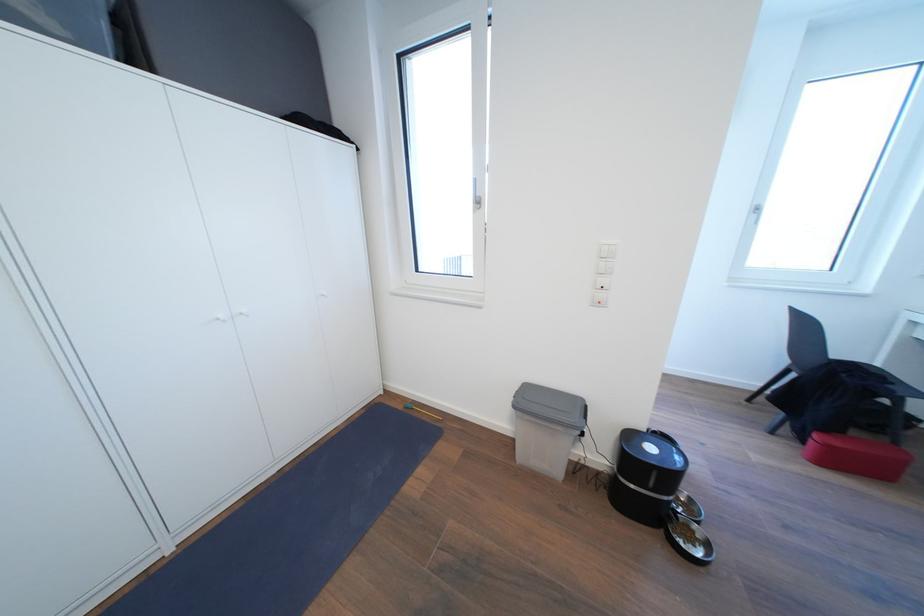
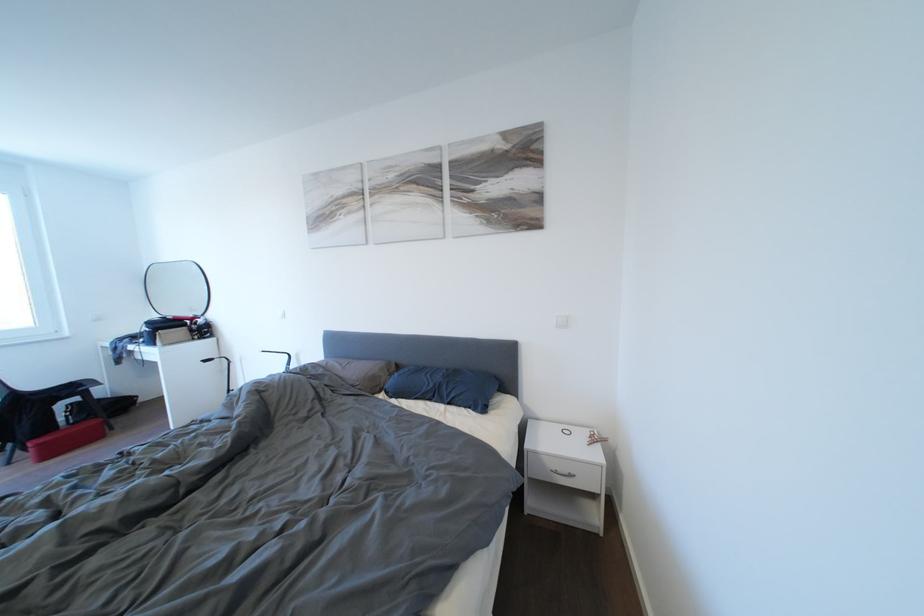
Locate, in the second image, the point that corresponds to the point at 835,451 in the first image.

(46, 450)